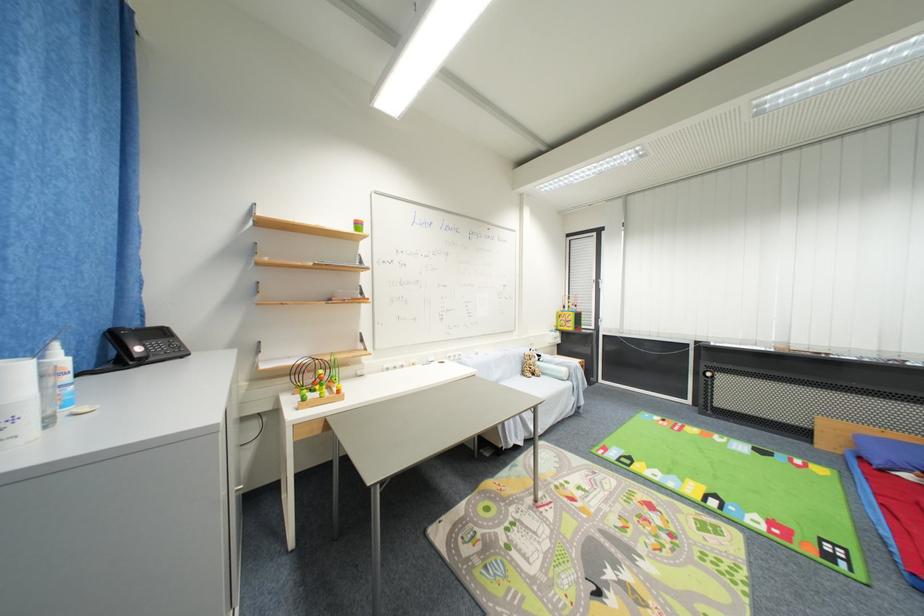
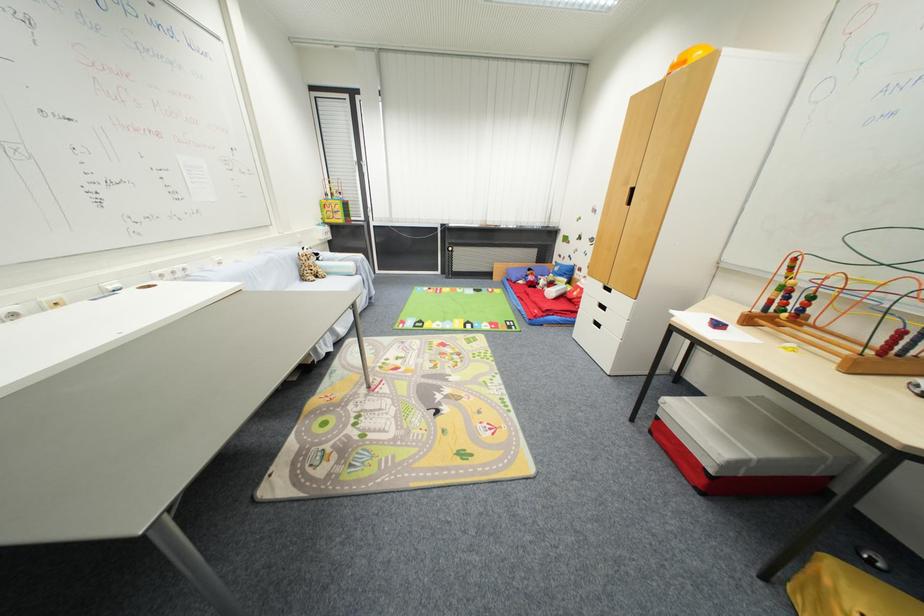
The first image is from the beginning of the video and the second image is from the end. How did the camera likely rotate when shooting the video?

The camera's rotation is toward right-down.